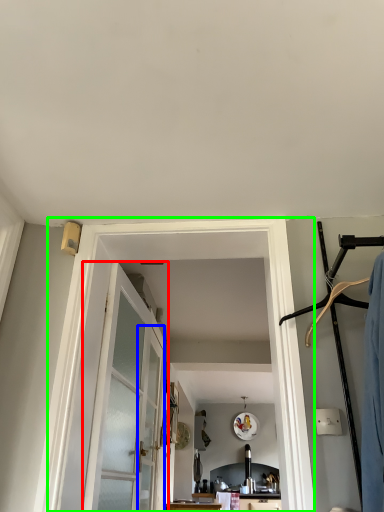
Question: Which object is the farthest from door (highlighted by a red box)? Choose among these: screen door (highlighted by a blue box) or barn door (highlighted by a green box).

Choices:
 (A) screen door
 (B) barn door

Answer: (B)